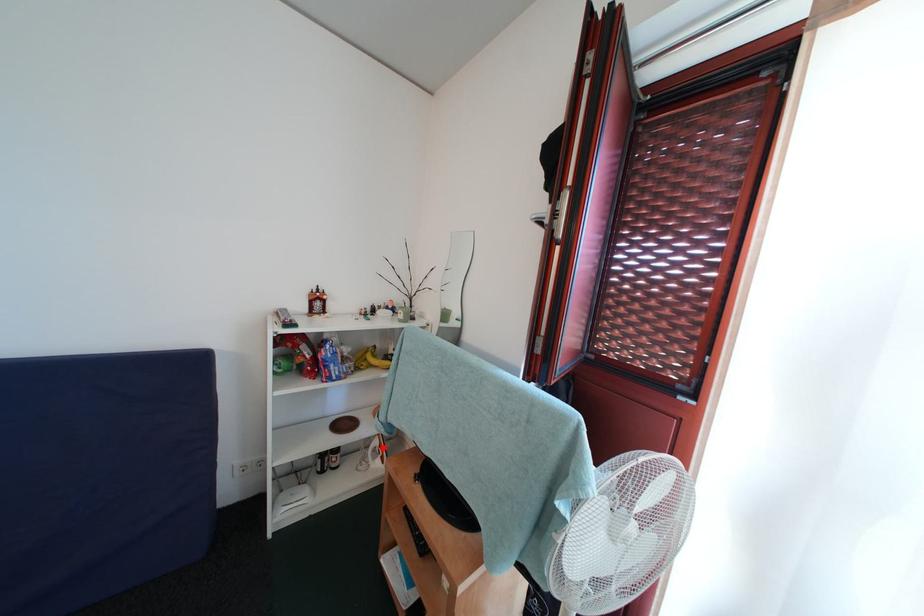
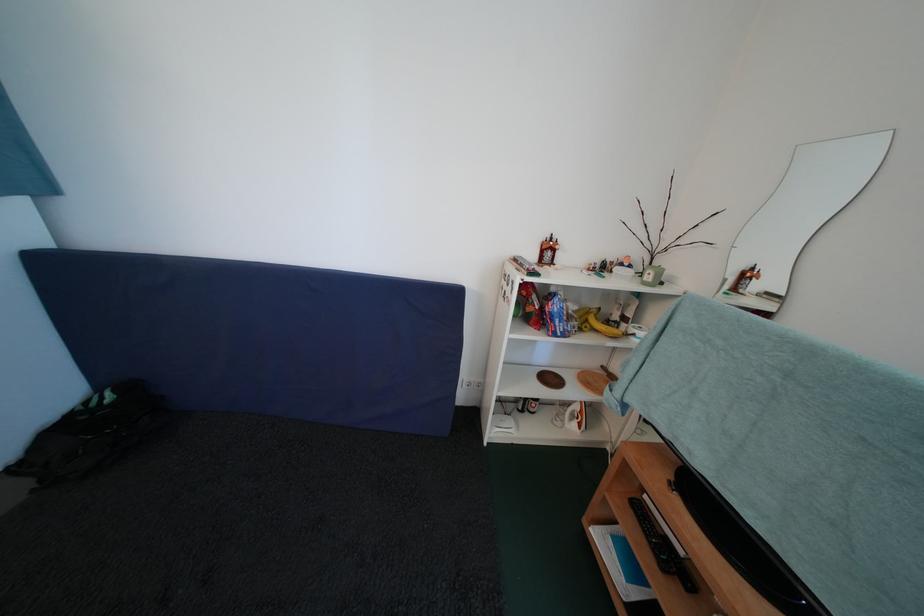
In the second image, find the point that corresponds to the highlighted location in the first image.

(584, 411)